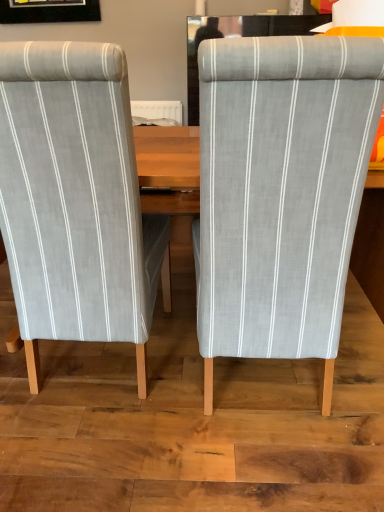
Question: Considering the positions of point (342, 286) and point (122, 333), is point (342, 286) closer or farther from the camera than point (122, 333)?

Choices:
 (A) closer
 (B) farther

Answer: (A)

Question: Is gray fabric chair at center, which appears as the 1th chair when viewed from the right, taller or shorter than light gray striped fabric chair at left, arranged as the first chair when viewed from the left?

Choices:
 (A) short
 (B) tall

Answer: (B)

Question: In the image, is gray fabric chair at center, positioned as the second chair in left-to-right order, positioned in front of or behind light gray striped fabric chair at left, which is the 2th chair in right-to-left order?

Choices:
 (A) front
 (B) behind

Answer: (A)

Question: Does point (79, 142) appear closer or farther from the camera than point (258, 150)?

Choices:
 (A) closer
 (B) farther

Answer: (B)

Question: Is light gray striped fabric chair at left, which is the 2th chair in right-to-left order, bigger or smaller than gray fabric chair at center, positioned as the second chair in left-to-right order?

Choices:
 (A) small
 (B) big

Answer: (B)

Question: From the image's perspective, is light gray striped fabric chair at left, arranged as the first chair when viewed from the left, located above or below gray fabric chair at center, positioned as the second chair in left-to-right order?

Choices:
 (A) below
 (B) above

Answer: (B)

Question: Is light gray striped fabric chair at left, which is the 2th chair in right-to-left order, wider or thinner than gray fabric chair at center, which appears as the 1th chair when viewed from the right?

Choices:
 (A) wide
 (B) thin

Answer: (B)